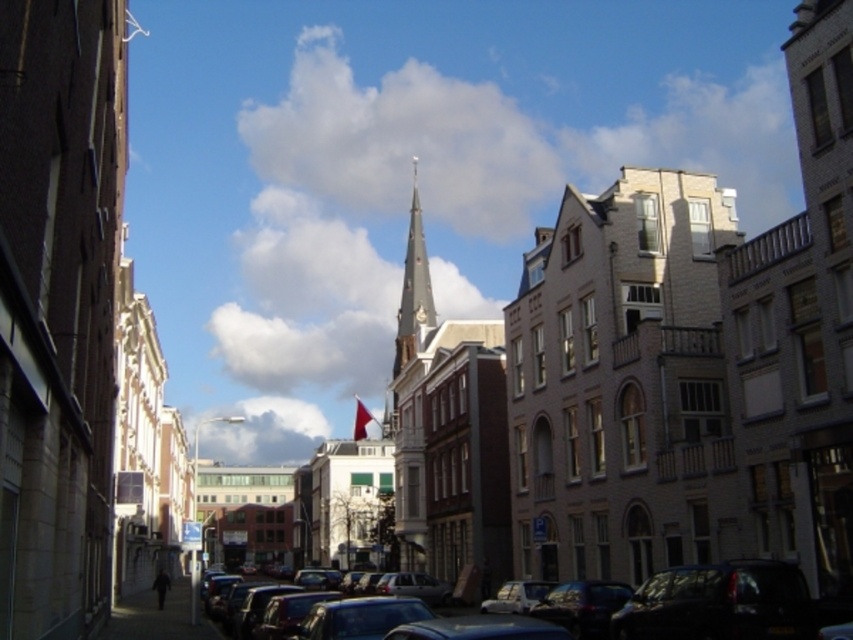
Does light beige stone church at center have a larger size compared to shiny black car at center?

Correct, light beige stone church at center is larger in size than shiny black car at center.

Who is taller, light beige stone church at center or shiny black car at center?

Standing taller between the two is light beige stone church at center.

Is point (692, 480) farther from viewer compared to point (751, 604)?

Yes, point (692, 480) is farther from viewer.

Find the location of a particular element. The width and height of the screenshot is (853, 640). light beige stone church at center is located at coordinates (619, 380).

Who is positioned more to the left, light beige stone church at center or dark gray asphalt at lower center?

Positioned to the left is dark gray asphalt at lower center.

Describe the element at coordinates (619, 380) in the screenshot. I see `light beige stone church at center` at that location.

Is point (729, 230) farther from viewer compared to point (146, 595)?

No, it is in front of (146, 595).

Where is `light beige stone church at center`? The width and height of the screenshot is (853, 640). light beige stone church at center is located at coordinates [x=619, y=380].

Between shiny black car at center and smooth gray steeple at center, which one has more height?

smooth gray steeple at center

Which of these two, shiny black car at center or smooth gray steeple at center, stands shorter?

With less height is shiny black car at center.

The width and height of the screenshot is (853, 640). Identify the location of shiny black car at center. (762, 600).